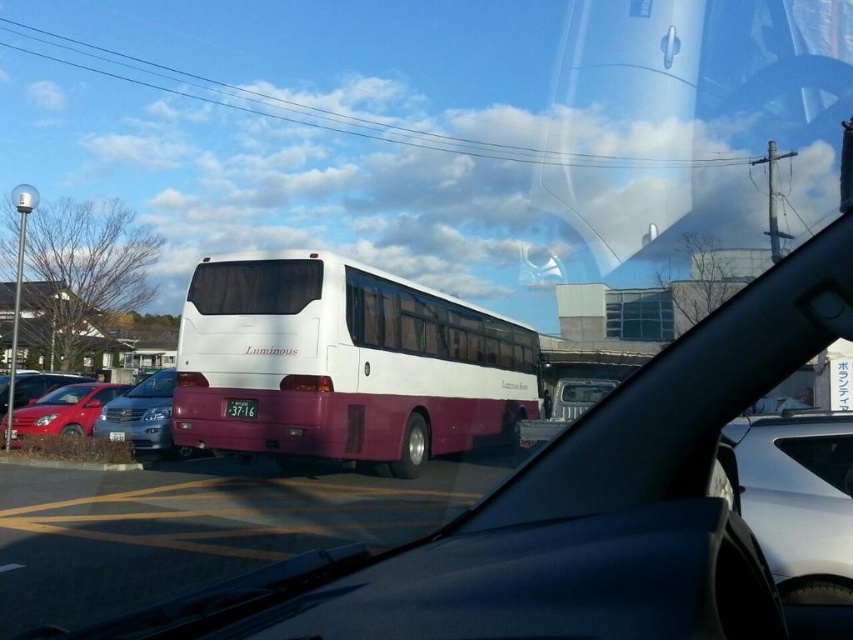
Question: Does shiny red sedan at lower left appear under white glossy license plate at center?

Choices:
 (A) no
 (B) yes

Answer: (B)

Question: Based on their relative distances, which object is farther from the shiny red sedan at lower left?

Choices:
 (A) white glossy license plate at center
 (B) satin silver sedan at center
 (C) white matte bus at center

Answer: (C)

Question: Can you confirm if white matte bus at center is positioned to the right of white glossy license plate at center?

Choices:
 (A) no
 (B) yes

Answer: (B)

Question: From the image, what is the correct spatial relationship of shiny red sedan at lower left in relation to white glossy license plate at center?

Choices:
 (A) above
 (B) below

Answer: (B)

Question: Which of the following is the farthest from the observer?

Choices:
 (A) (53, 433)
 (B) (146, 390)

Answer: (B)

Question: Estimate the real-world distances between objects in this image. Which object is closer to the shiny red sedan at lower left?

Choices:
 (A) satin silver sedan at center
 (B) white glossy license plate at center
 (C) white matte bus at center

Answer: (A)